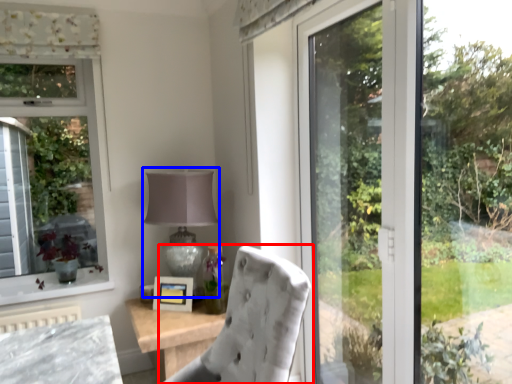
Question: Among these objects, which one is farthest to the camera, chair (highlighted by a red box) or table lamp (highlighted by a blue box)?

Choices:
 (A) chair
 (B) table lamp

Answer: (B)